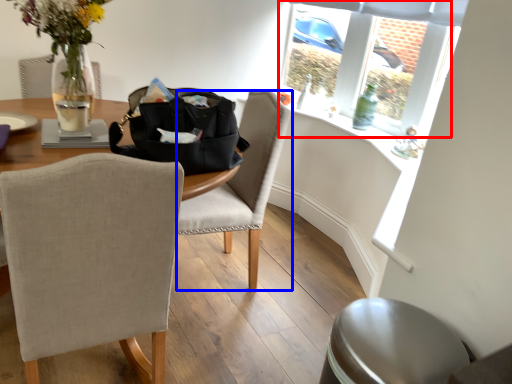
Question: Which point is closer to the camera, bay window (highlighted by a red box) or chair (highlighted by a blue box)?

Choices:
 (A) bay window
 (B) chair

Answer: (B)